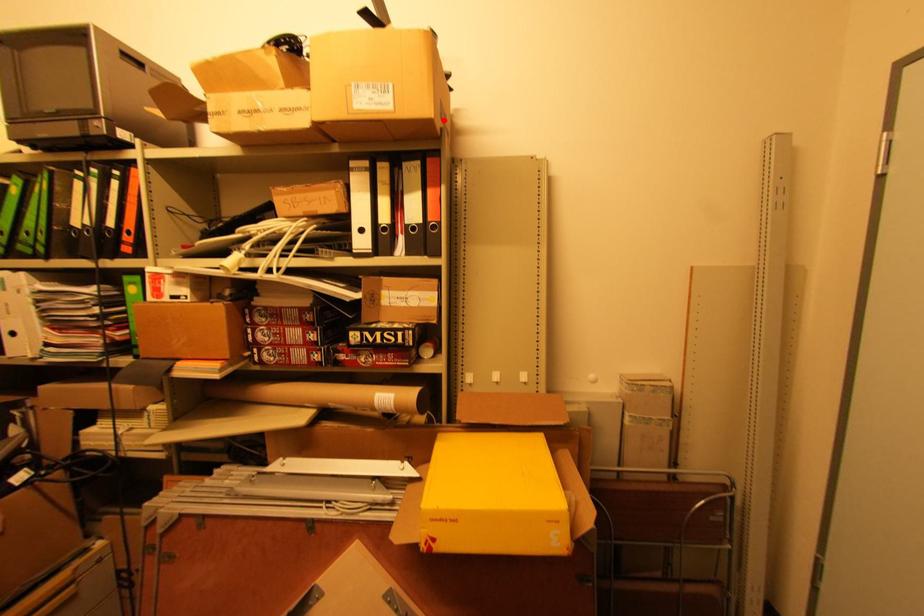
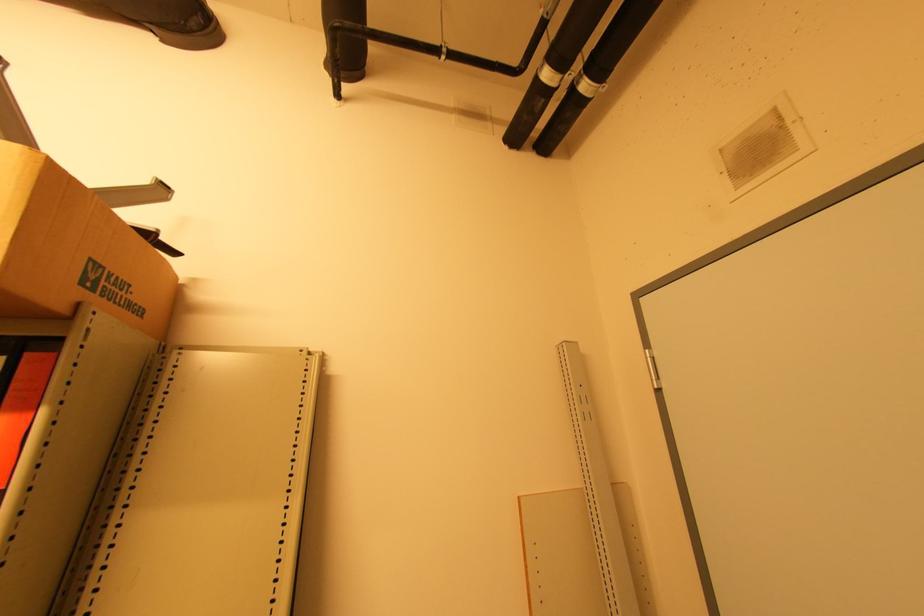
Find the pixel in the second image that matches the highlighted location in the first image.

(95, 290)